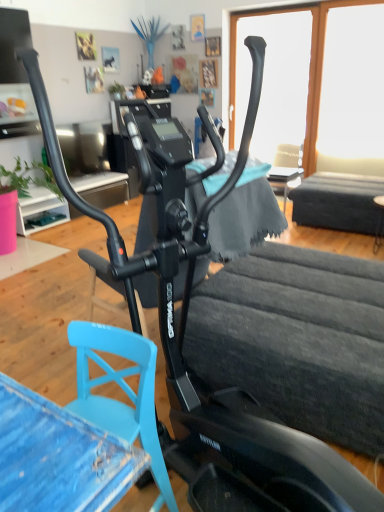
Question: Are transparent glass window at upper center, which appears as the first window screen when viewed from the left, and soft blue cloth at center far apart?

Choices:
 (A) yes
 (B) no

Answer: (A)

Question: Is transparent glass window at upper center, which appears as the first window screen when viewed from the left, thinner than soft blue cloth at center?

Choices:
 (A) no
 (B) yes

Answer: (B)

Question: Is transparent glass window at upper center, arranged as the 2th window screen when viewed from the right, bigger than soft blue cloth at center?

Choices:
 (A) yes
 (B) no

Answer: (A)

Question: Does transparent glass window at upper center, arranged as the 2th window screen when viewed from the right, have a smaller size compared to soft blue cloth at center?

Choices:
 (A) yes
 (B) no

Answer: (B)

Question: From the image's perspective, would you say transparent glass window at upper center, arranged as the 2th window screen when viewed from the right, is shown under soft blue cloth at center?

Choices:
 (A) yes
 (B) no

Answer: (B)

Question: Is transparent glass window at upper center, arranged as the 2th window screen when viewed from the right, not inside soft blue cloth at center?

Choices:
 (A) yes
 (B) no

Answer: (A)

Question: Is smooth wooden table at right, positioned as the 2th table in front-to-back order, not within black matte table at lower right, the second table from the back?

Choices:
 (A) no
 (B) yes

Answer: (B)

Question: From a real-world perspective, is smooth wooden table at right, positioned as the 2th table in front-to-back order, under black matte table at lower right, which is counted as the 1th table, starting from the front?

Choices:
 (A) no
 (B) yes

Answer: (A)

Question: From a real-world perspective, is smooth wooden table at right, the 1th table when ordered from back to front, positioned over black matte table at lower right, the second table from the back, based on gravity?

Choices:
 (A) yes
 (B) no

Answer: (A)

Question: Is smooth wooden table at right, positioned as the 2th table in front-to-back order, closer to the viewer compared to black matte table at lower right, the second table from the back?

Choices:
 (A) no
 (B) yes

Answer: (A)

Question: Could you tell me if smooth wooden table at right, positioned as the 2th table in front-to-back order, is facing black matte table at lower right, which is counted as the 1th table, starting from the front?

Choices:
 (A) yes
 (B) no

Answer: (B)

Question: From the image's perspective, is smooth wooden table at right, the 1th table when ordered from back to front, under black matte table at lower right, which is counted as the 1th table, starting from the front?

Choices:
 (A) yes
 (B) no

Answer: (B)

Question: Is transparent glass window at upper right, the second window screen viewed from the left, completely or partially outside of black matte table at lower right, the second table from the back?

Choices:
 (A) yes
 (B) no

Answer: (A)